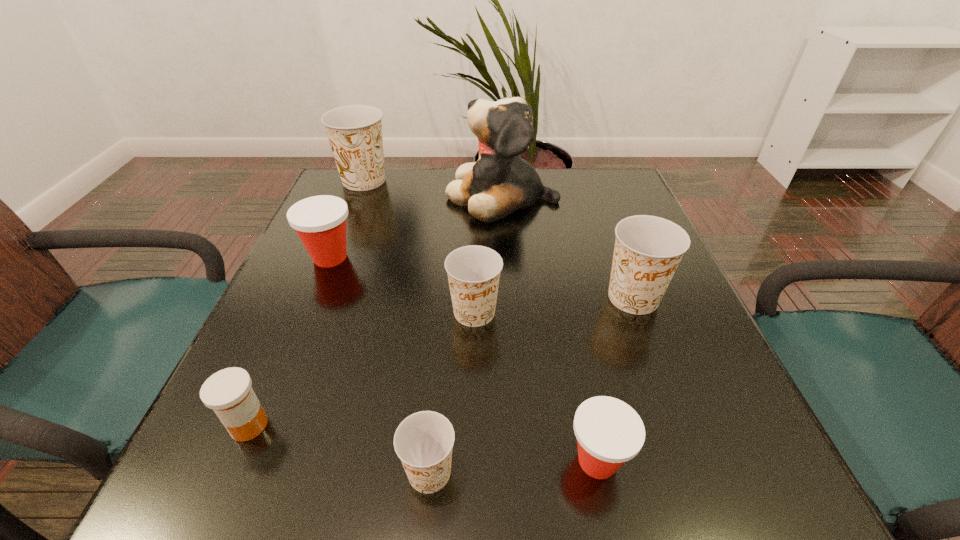
Where is `free space at the left edge of the desktop`? free space at the left edge of the desktop is located at coordinates (370, 242).

In the image, there is a desktop. Where is `free region at the right edge`? free region at the right edge is located at coordinates (667, 300).

In the image, there is a desktop. Where is `vacant space at the far left corner`? The image size is (960, 540). vacant space at the far left corner is located at coordinates (358, 199).

Image resolution: width=960 pixels, height=540 pixels. I want to click on free point at the far right corner, so click(572, 179).

Where is `free space that is in between the rightmost object and the nearer red-orange Dixie cup`? free space that is in between the rightmost object and the nearer red-orange Dixie cup is located at coordinates (615, 379).

This screenshot has height=540, width=960. I want to click on free space between the second smallest orange Dixie cup and the left red-orange Dixie cup, so click(x=402, y=285).

You are a GUI agent. You are given a task and a screenshot of the screen. Output one action in this format:
    pyautogui.click(x=<x>, y=<y>)
    Task: Click on the vacant area between the third tallest object and the biggest orange Dixie cup
    This screenshot has width=960, height=540.
    Given the screenshot: What is the action you would take?
    (498, 239)

This screenshot has width=960, height=540. What are the coordinates of `unoccupied area between the nearest orange Dixie cup and the third biggest orange Dixie cup` in the screenshot? It's located at (452, 393).

You are a GUI agent. You are given a task and a screenshot of the screen. Output one action in this format:
    pyautogui.click(x=<x>, y=<y>)
    Task: Click on the vacant space that's between the orange medicine and the smallest orange Dixie cup
    
    Given the screenshot: What is the action you would take?
    pyautogui.click(x=339, y=449)

Locate an element on the screen. vacant area between the puppy and the second biggest orange Dixie cup is located at coordinates (567, 246).